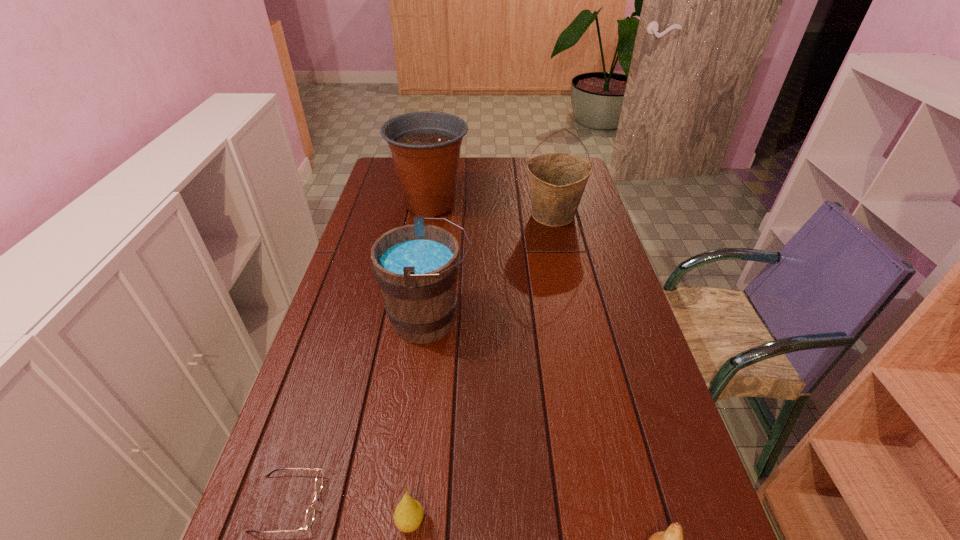
You are a GUI agent. You are given a task and a screenshot of the screen. Output one action in this format:
    pyautogui.click(x=<x>, y=<y>)
    Task: Click on the right wine bucket
    The height and width of the screenshot is (540, 960).
    Given the screenshot: What is the action you would take?
    pyautogui.click(x=557, y=181)

Image resolution: width=960 pixels, height=540 pixels. What are the coordinates of `the taller wine bucket` in the screenshot? It's located at (557, 181).

Find the location of a particular element. This screenshot has height=540, width=960. flowerpot is located at coordinates (425, 146).

Locate an element on the screen. Image resolution: width=960 pixels, height=540 pixels. the shorter wine bucket is located at coordinates (416, 266).

Find the location of a particular element. The image size is (960, 540). the nearer wine bucket is located at coordinates (416, 266).

The height and width of the screenshot is (540, 960). Identify the location of the left pear. (408, 515).

This screenshot has width=960, height=540. In order to click on the shortest object in this screenshot , I will do `click(310, 513)`.

Identify the location of free space located on the left of the farther wine bucket. The height and width of the screenshot is (540, 960). (414, 215).

Identify the location of vacant space situated 0.120m on the front of the flowerpot. The image size is (960, 540). (423, 247).

You are a GUI agent. You are given a task and a screenshot of the screen. Output one action in this format:
    pyautogui.click(x=<x>, y=<y>)
    Task: Click on the free space located with a handle on the side of the nearer wine bucket
    This screenshot has height=540, width=960.
    Given the screenshot: What is the action you would take?
    pyautogui.click(x=549, y=320)